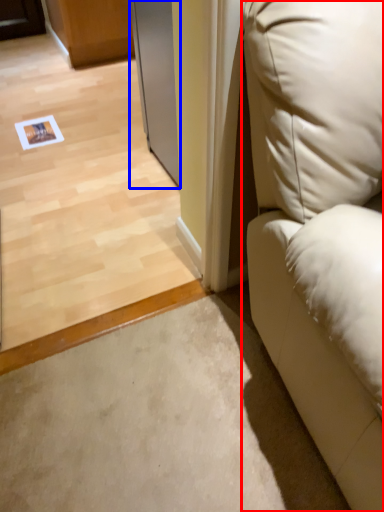
Question: Which object appears closest to the camera in this image, furniture (highlighted by a red box) or screen door (highlighted by a blue box)?

Choices:
 (A) furniture
 (B) screen door

Answer: (A)